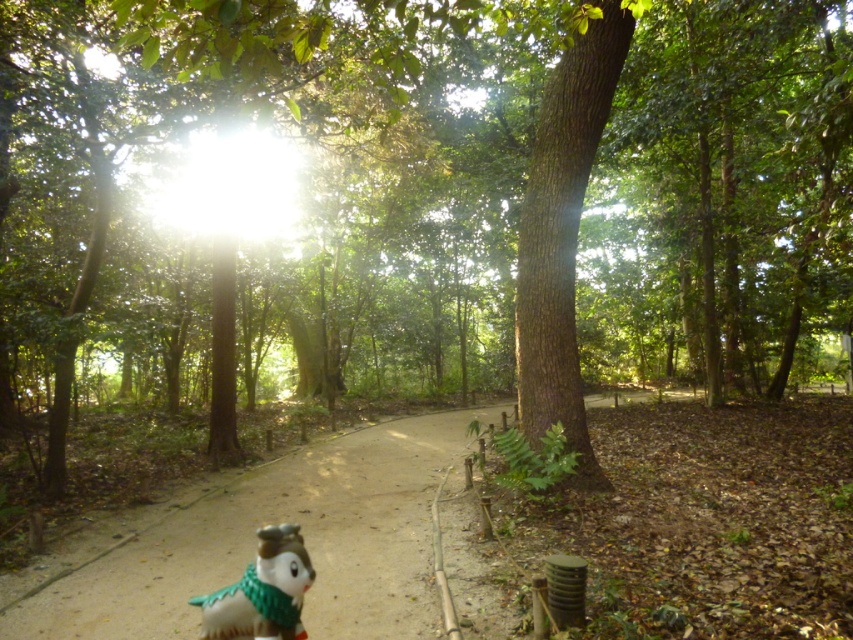
Looking at this image, you are a hiker who wants to place a small gift for a friend who loves owls. The gift is a porcelain owl figurine. You see the porcelain figurine at lower center and the sandy dirt path at center. Where should you place the gift so it is visible from the path?

Place the gift on the sandy dirt path at center to the left of the porcelain figurine at lower center so it is visible from the path.